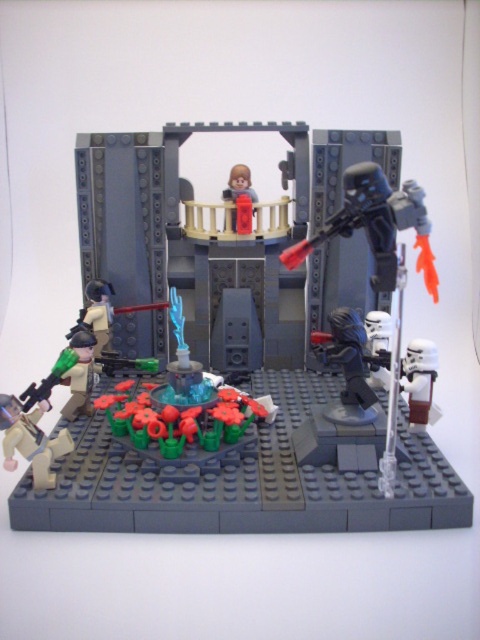
In the LEGO diorama scene, there is a translucent plastic stormtrooper at upper right and a light brown plastic figure at lower left. From the perspective of an observer looking at the image, which of these two figures is positioned to the right?

The translucent plastic stormtrooper at upper right is positioned to the right of the light brown plastic figure at lower left.

You are a visitor in this LEGO diorama scene. You want to find the light brown plastic figure at lower left. According to the coordinates provided, where exactly should you look to locate it?

The light brown plastic figure at lower left is located at coordinates point [31,440].

You are a visitor in this LEGO diorama and need to determine which character is taller. You see the translucent plastic stormtrooper at upper right and the light brown plastic figure at lower left. Which one is taller?

The translucent plastic stormtrooper at upper right is taller than the light brown plastic figure at lower left.